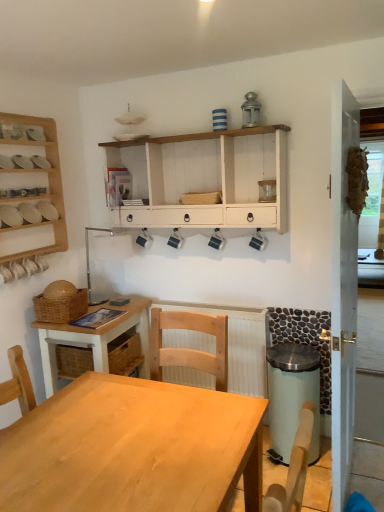
Question: Considering the positions of wooden screen door at right and white painted wood shelf at upper center, the 2th shelf from the left, in the image, is wooden screen door at right taller or shorter than white painted wood shelf at upper center, the 2th shelf from the left,?

Choices:
 (A) tall
 (B) short

Answer: (A)

Question: From a real-world perspective, relative to white painted wood shelf at upper center, the 2th shelf from the left, is wooden screen door at right vertically above or below?

Choices:
 (A) above
 (B) below

Answer: (B)

Question: Estimate the real-world distances between objects in this image. Which object is farther from the white textured radiator at center?

Choices:
 (A) light green plastic trash bin at lower right
 (B) wooden shelf at left
 (C) woven brown basket at center, placed as the first basket when sorted from top to bottom
 (D) light wood table at center
 (E) white painted wood shelf at upper center, arranged as the 1th shelf when viewed from the right

Answer: (B)

Question: Which object is positioned closest to the light green plastic trash bin at lower right?

Choices:
 (A) white painted wood shelf at upper center, arranged as the 1th shelf when viewed from the right
 (B) woven brown basket at center, placed as the first basket when sorted from top to bottom
 (C) wooden screen door at right
 (D) white textured radiator at center
 (E) light wood table at center

Answer: (D)